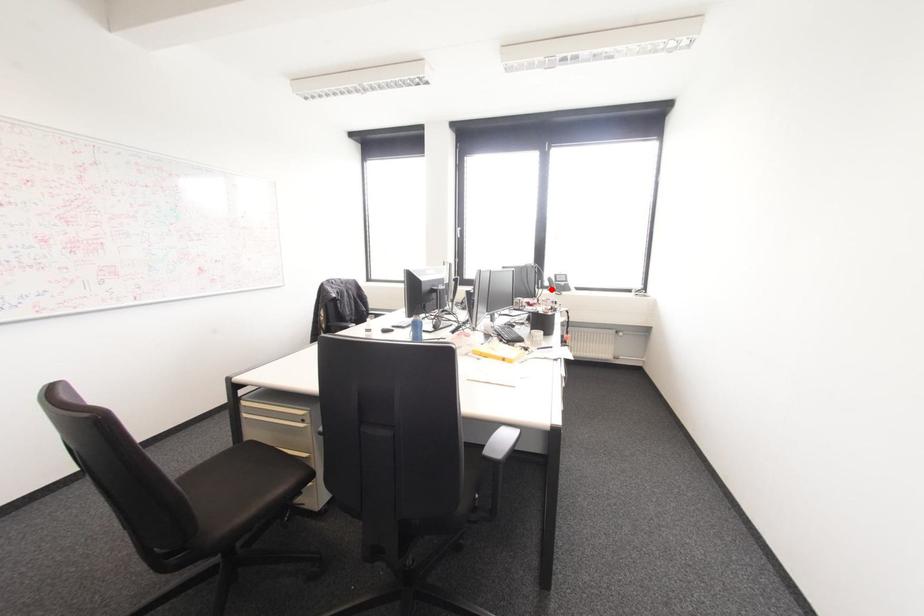
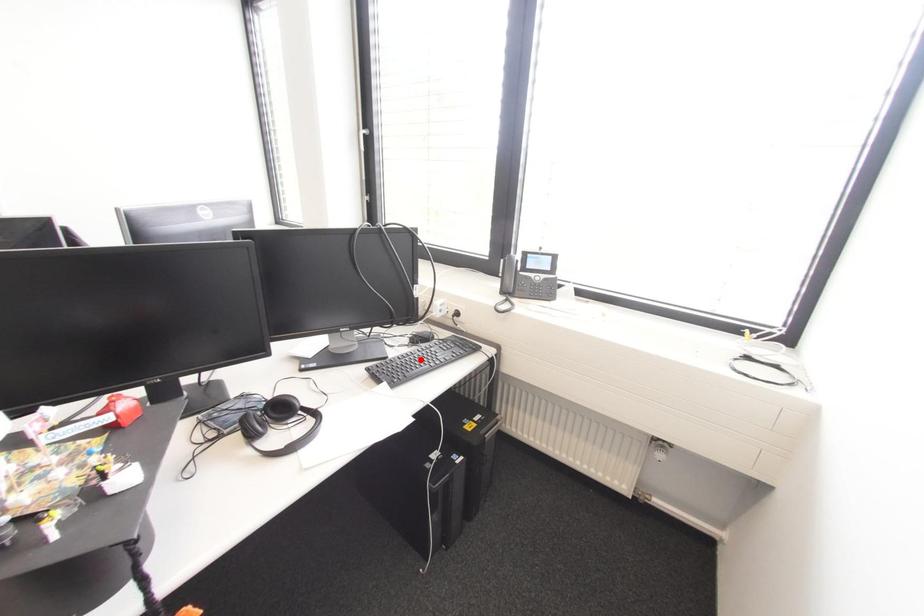
I am providing you with two images of the same scene from different viewpoints. A red point is marked on the first image and another point is marked on the second image. Are the points marked in image1 and image2 representing the same 3D position?

No